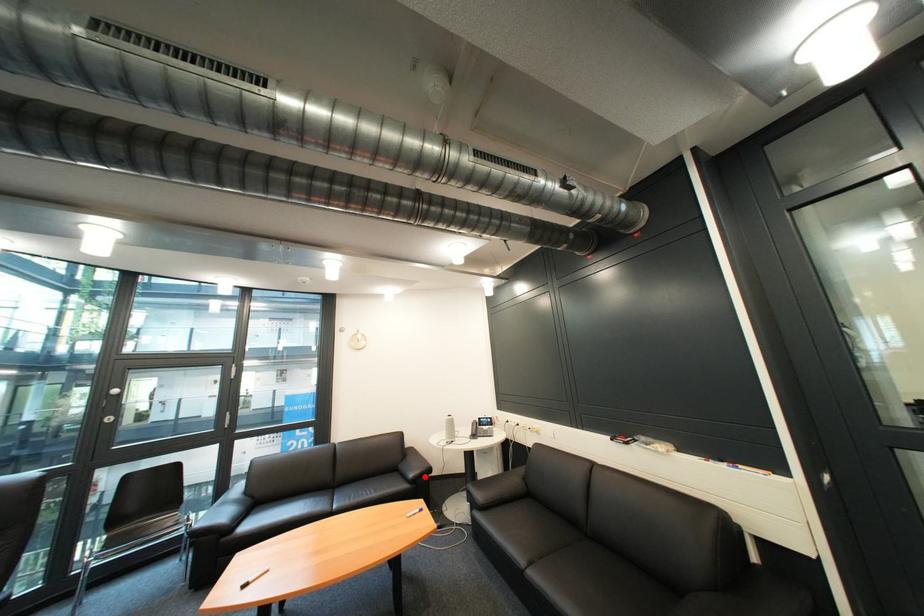
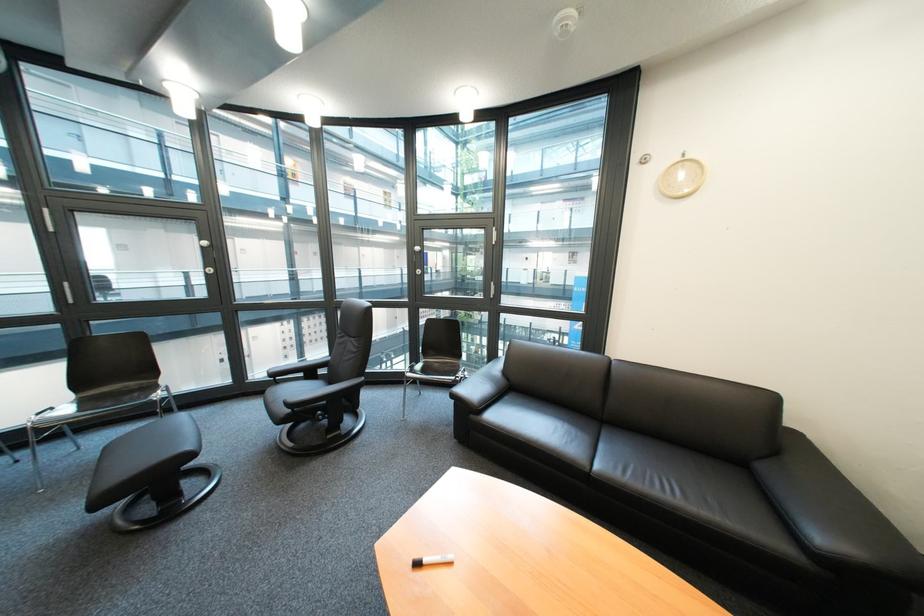
In the second image, find the point that corresponds to the highlighted location in the first image.

(833, 540)